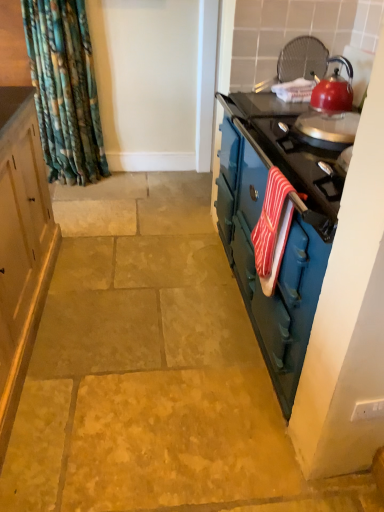
Question: Considering the positions of teal glossy dresser at right and red striped towel at right in the image, is teal glossy dresser at right wider or thinner than red striped towel at right?

Choices:
 (A) wide
 (B) thin

Answer: (A)

Question: Choose the correct answer: Is teal glossy dresser at right inside red striped towel at right or outside it?

Choices:
 (A) inside
 (B) outside

Answer: (B)

Question: Which object is positioned farthest from the shiny red kettle at upper right?

Choices:
 (A) red striped towel at right
 (B) teal glossy dresser at right

Answer: (A)

Question: Which of these objects is positioned closest to the shiny red kettle at upper right?

Choices:
 (A) teal glossy dresser at right
 (B) red striped towel at right

Answer: (A)